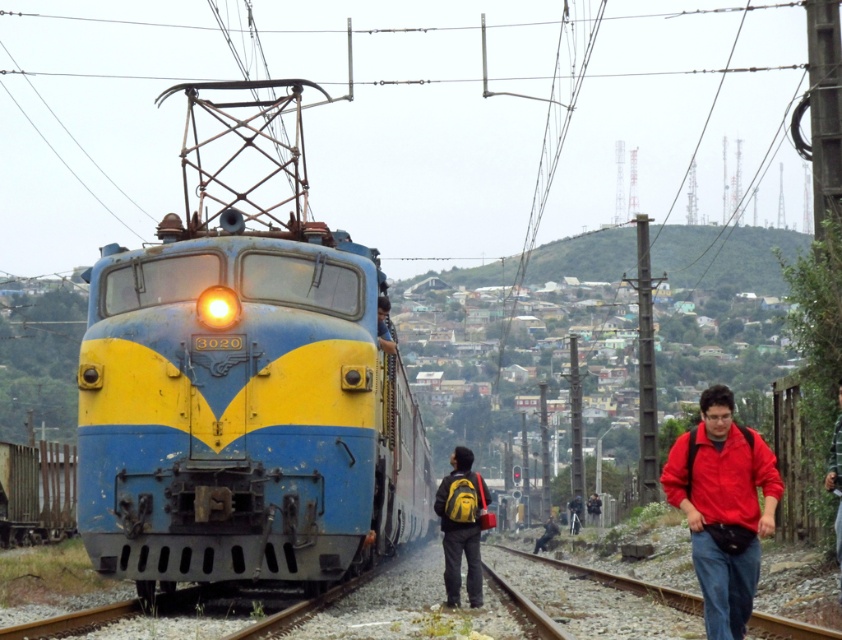
Is point (707, 588) farther from camera compared to point (380, 346)?

No, it is in front of (380, 346).

Can you confirm if red matte jacket at lower right is positioned to the left of blue fabric jacket at center?

No, red matte jacket at lower right is not to the left of blue fabric jacket at center.

Find the location of a particular element. This screenshot has width=842, height=640. red matte jacket at lower right is located at coordinates (723, 508).

Is red matte jacket at lower right wider than red jacket at lower right?

Indeed, red matte jacket at lower right has a greater width compared to red jacket at lower right.

Who is more distant from viewer, (757, 472) or (840, 518)?

Point (840, 518)

Where is `red matte jacket at lower right`? red matte jacket at lower right is located at coordinates pyautogui.click(x=723, y=508).

Does yellow backpack at center have a greater width compared to red jacket at lower right?

Yes, yellow backpack at center is wider than red jacket at lower right.

Which of these two, yellow backpack at center or red jacket at lower right, stands taller?

yellow backpack at center

You are a GUI agent. You are given a task and a screenshot of the screen. Output one action in this format:
    pyautogui.click(x=<x>, y=<y>)
    Task: Click on the yellow backpack at center
    The image size is (842, 640).
    Given the screenshot: What is the action you would take?
    pyautogui.click(x=461, y=525)